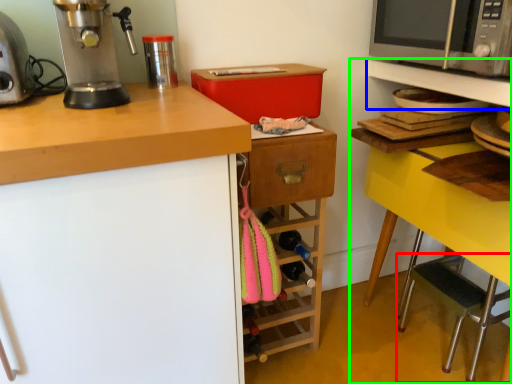
Question: Which object is the closest to the step stool (highlighted by a red box)? Choose among these: shelf (highlighted by a blue box) or shelf (highlighted by a green box).

Choices:
 (A) shelf
 (B) shelf

Answer: (B)